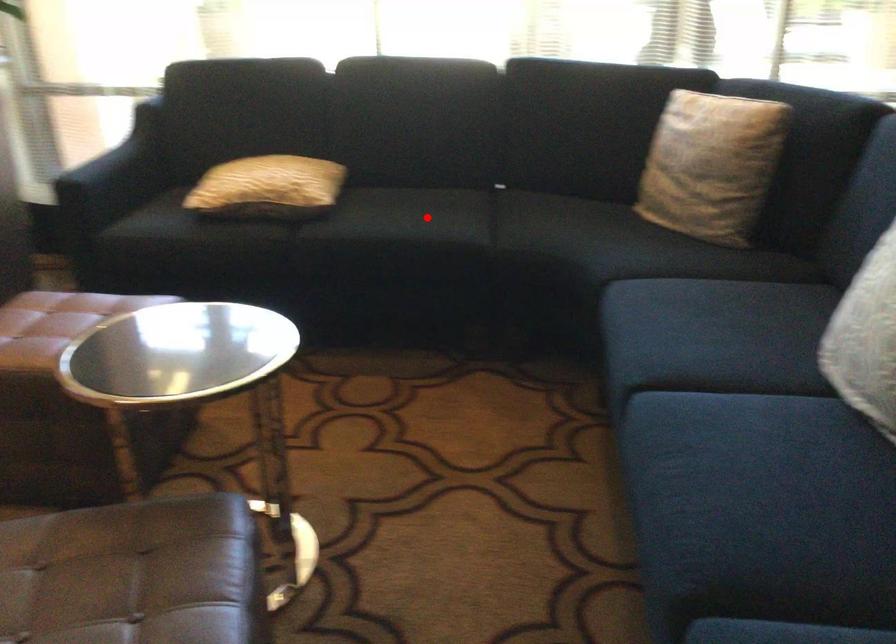
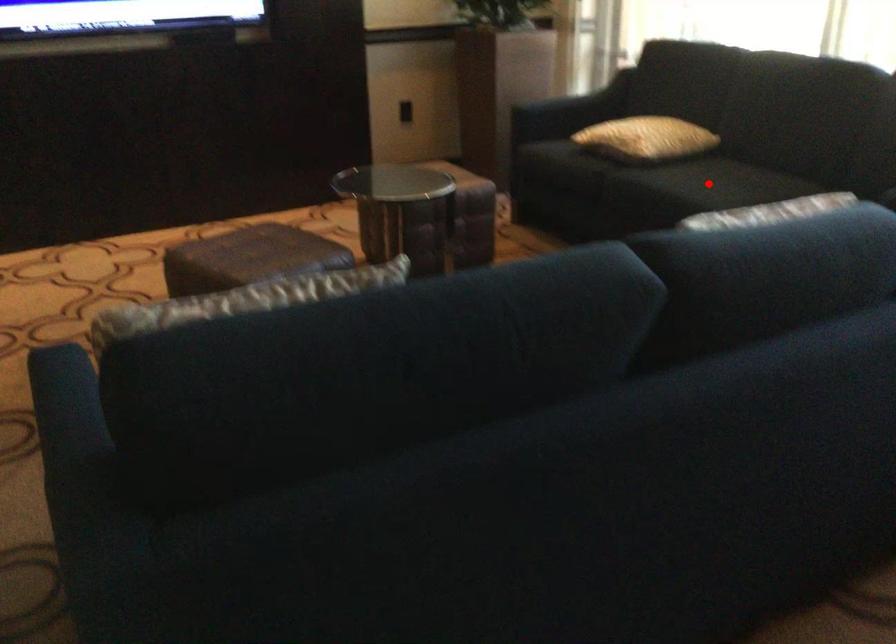
I am providing you with two images of the same scene from different viewpoints. A red point is marked on the first image and another point is marked on the second image. Is the marked point in image1 the same physical position as the marked point in image2?

Yes